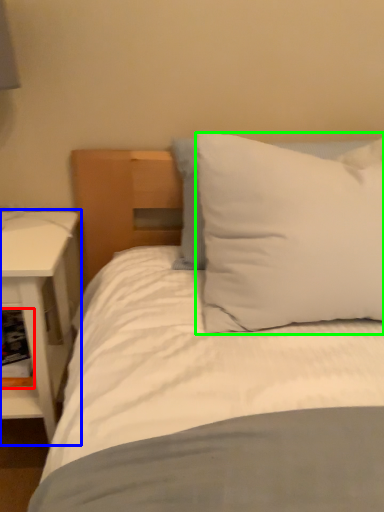
Question: Considering the real-world distances, which object is farthest from shelf (highlighted by a red box)? nightstand (highlighted by a blue box) or pillow (highlighted by a green box)?

Choices:
 (A) nightstand
 (B) pillow

Answer: (B)